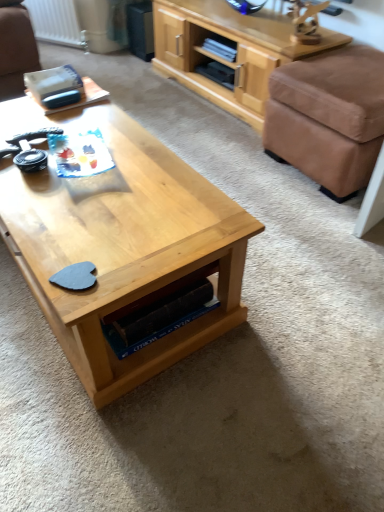
This screenshot has height=512, width=384. Find the location of `blank space situated above light wood coffee table at center (from a real-world perspective)`. blank space situated above light wood coffee table at center (from a real-world perspective) is located at coordinates (92, 165).